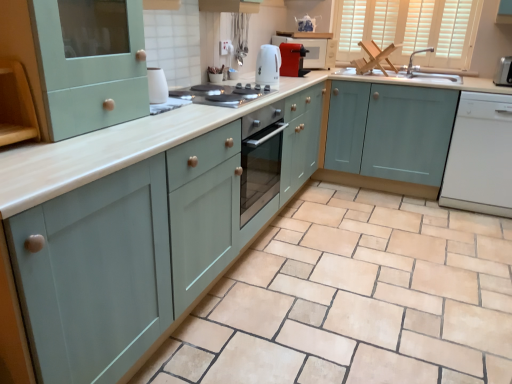
Identify the location of free point to the right of white glossy electric kettle at center, which is counted as the 2th appliance, starting from the left. This screenshot has width=512, height=384. (291, 84).